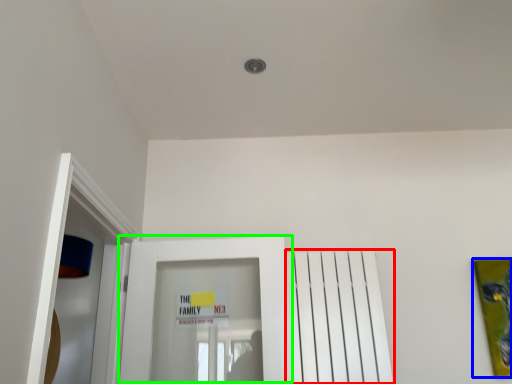
Question: Which object is positioned closest to radiator (highlighted by a red box)? Select from picture frame (highlighted by a blue box) and door (highlighted by a green box).

Choices:
 (A) picture frame
 (B) door

Answer: (B)